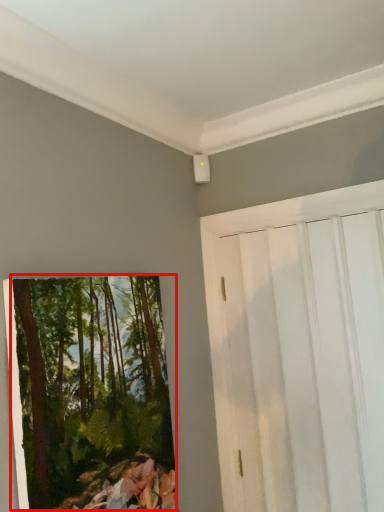
Question: From the image's perspective, where is tree (annotated by the red box) located in relation to barn door in the image?

Choices:
 (A) below
 (B) above

Answer: (A)